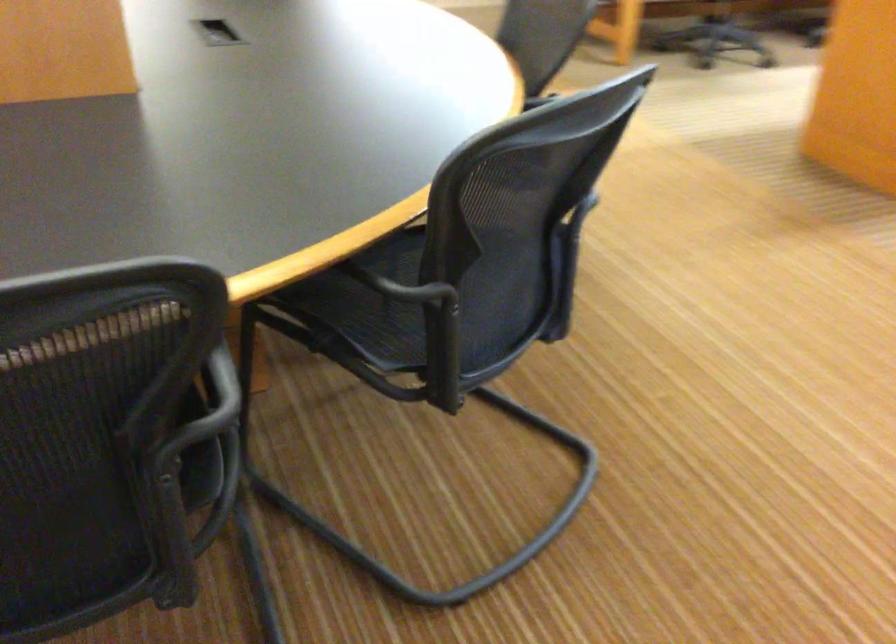
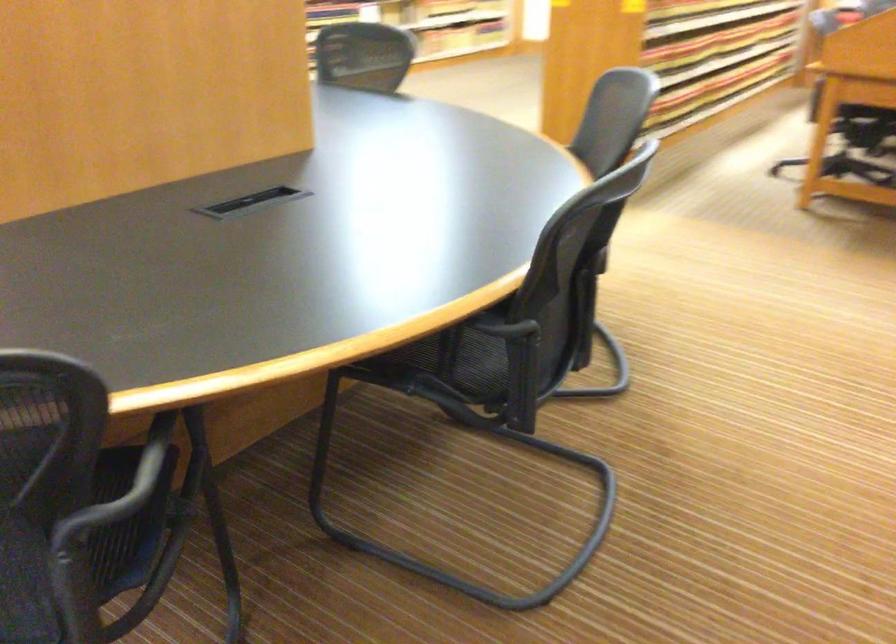
Question: I am providing you with two images of the same scene from different viewpoints. Which of the following objects are not visible in image2?

Choices:
 (A) black chair armrest
 (B) chair sitting surface
 (C) chair armrest
 (D) jar latch

Answer: (A)